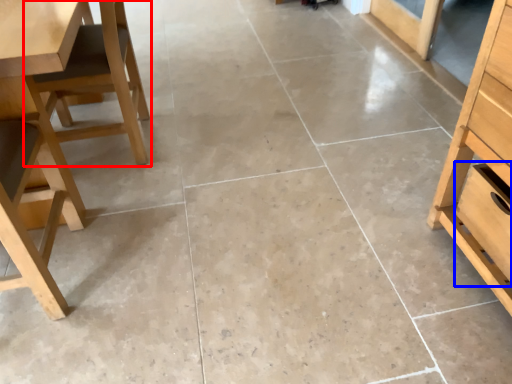
Question: Which of the following is the closest to the observer, chair (highlighted by a red box) or drawer (highlighted by a blue box)?

Choices:
 (A) chair
 (B) drawer

Answer: (B)